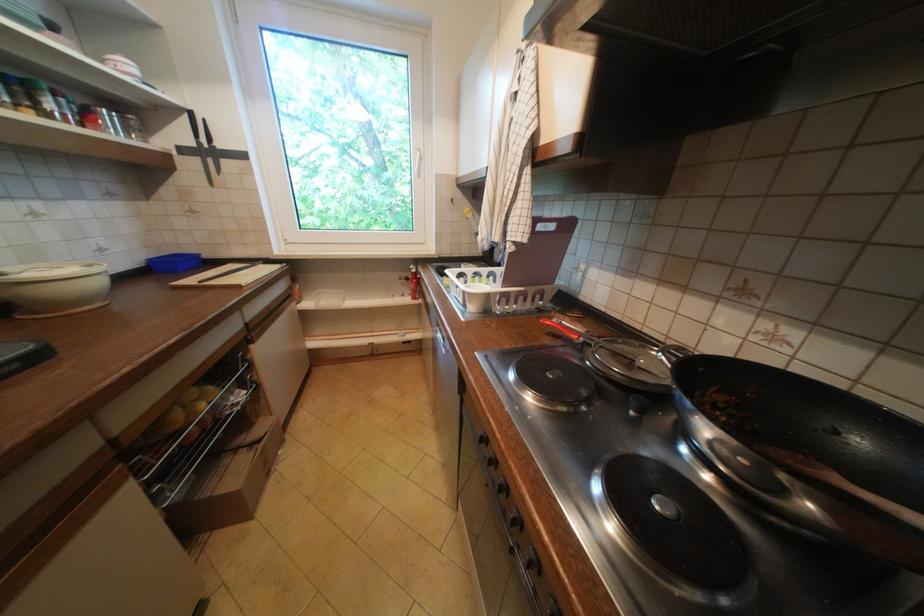
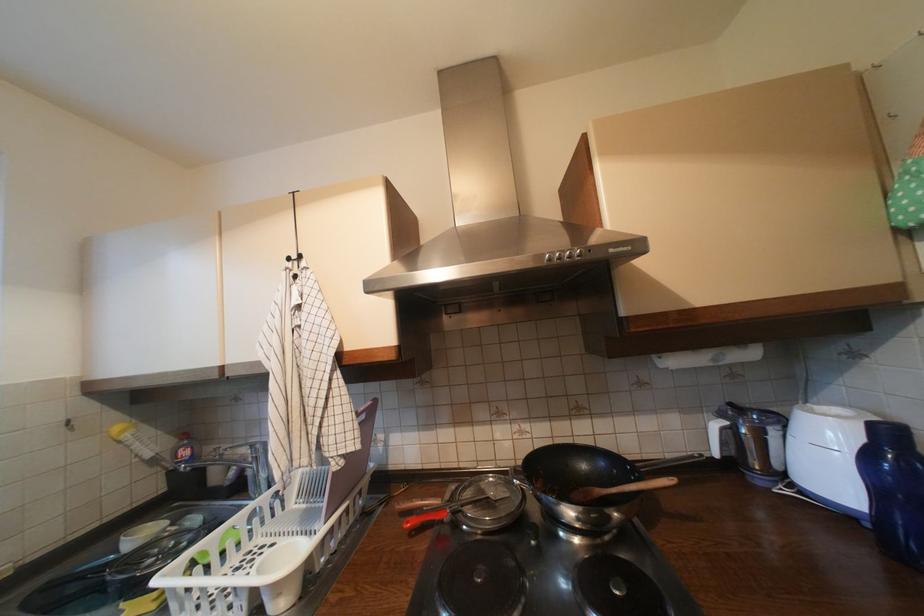
Find the pixel in the second image that matches [877,496] in the first image.

(623, 492)